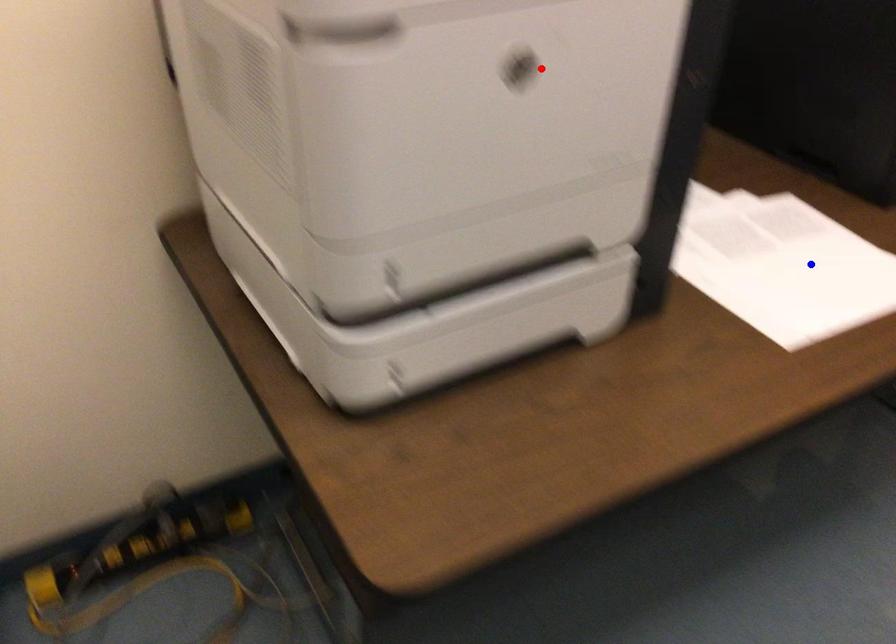
Question: In the image, two points are highlighted. Which point is nearer to the camera? Reply with the corresponding letter.

Choices:
 (A) blue point
 (B) red point

Answer: (B)